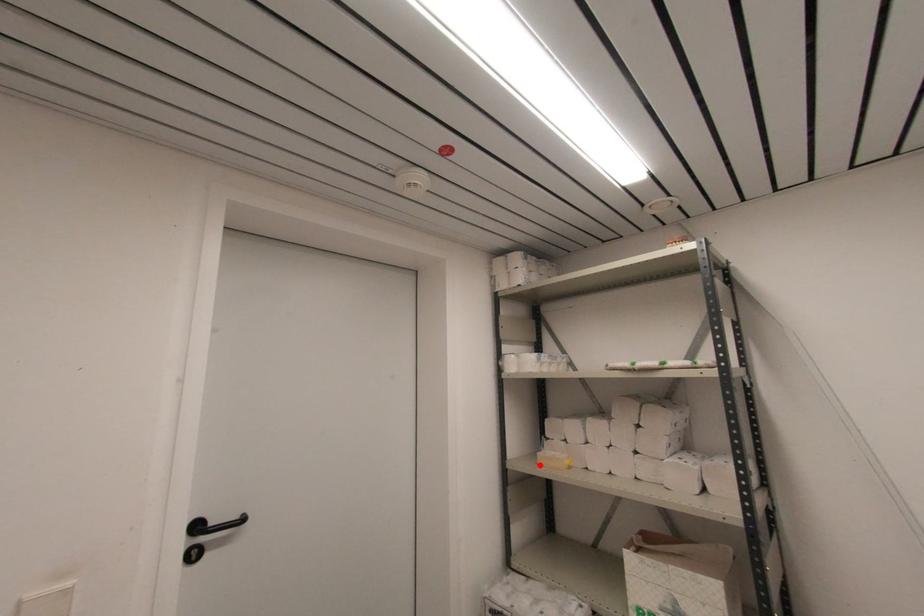
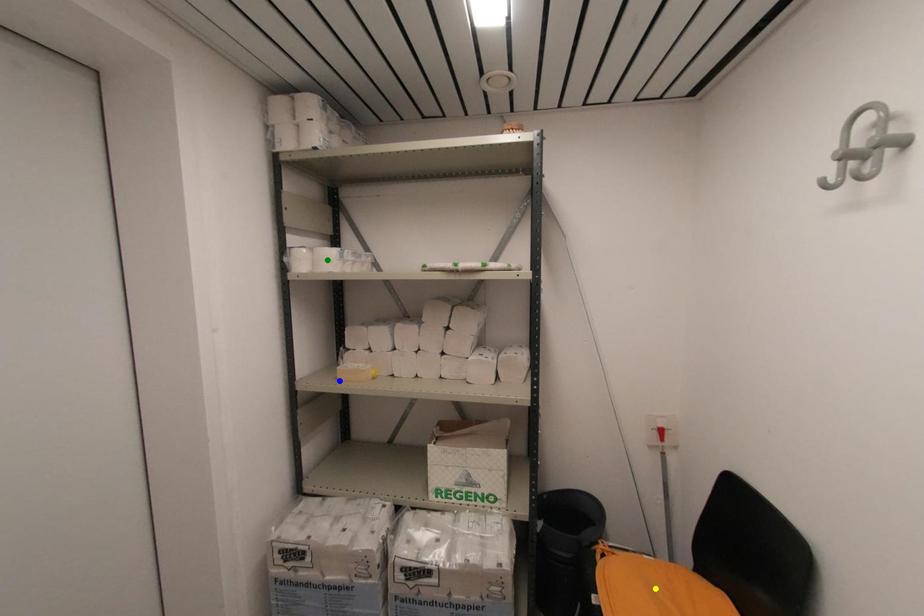
Question: I am providing you with two images of the same scene from different viewpoints. A red point is marked on the first image. You are given multiple points on the second image. Can you choose the point in image 2 that corresponds to the point in image 1?

Choices:
 (A) blue point
 (B) green point
 (C) yellow point

Answer: (A)